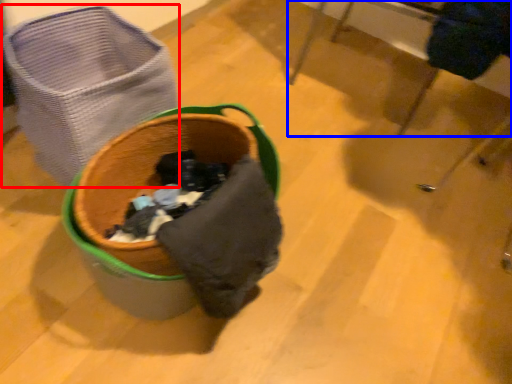
Question: Which of the following is the farthest to the observer, laundry basket (highlighted by a red box) or furniture (highlighted by a blue box)?

Choices:
 (A) laundry basket
 (B) furniture

Answer: (B)